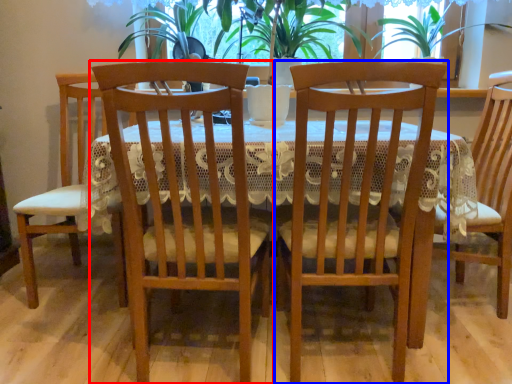
Question: Which object is further to the camera taking this photo, chair (highlighted by a red box) or chair (highlighted by a blue box)?

Choices:
 (A) chair
 (B) chair

Answer: (B)